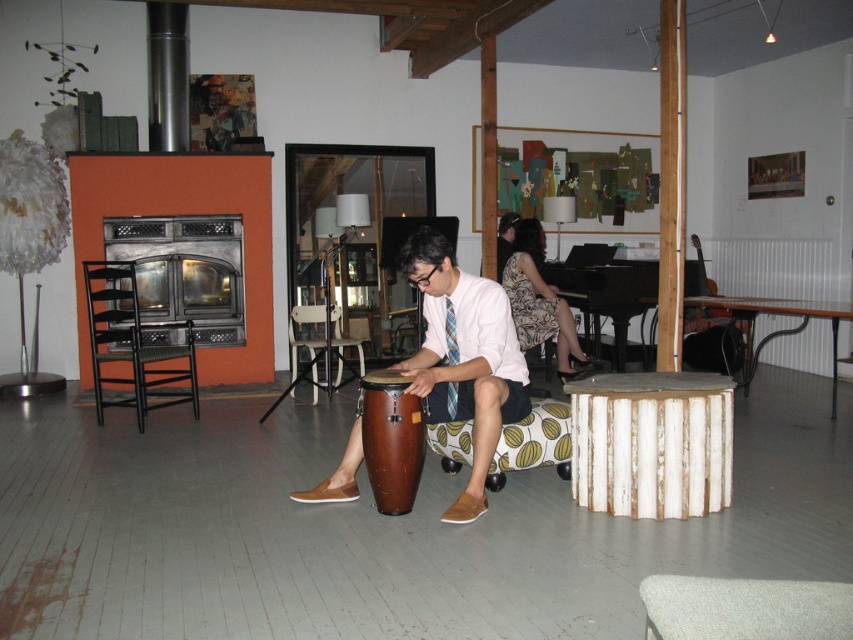
You are a photographer setting up for a photoshoot in this artistic space. You have two items to position in the center of the room for a closeup shot. The brown leather drum at center and the patterned fabric dress at center. Which item has a smaller width and would be better suited for a tighter composition?

The brown leather drum at center is thinner than the patterned fabric dress at center, making it better suited for a tighter composition.